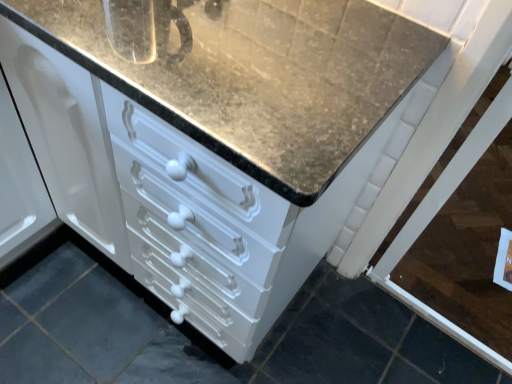
The height and width of the screenshot is (384, 512). What do you see at coordinates (460, 233) in the screenshot?
I see `white glossy screen door at right` at bounding box center [460, 233].

The width and height of the screenshot is (512, 384). I want to click on white glossy screen door at right, so click(460, 233).

Where is `white glossy screen door at right`? The height and width of the screenshot is (384, 512). white glossy screen door at right is located at coordinates (460, 233).